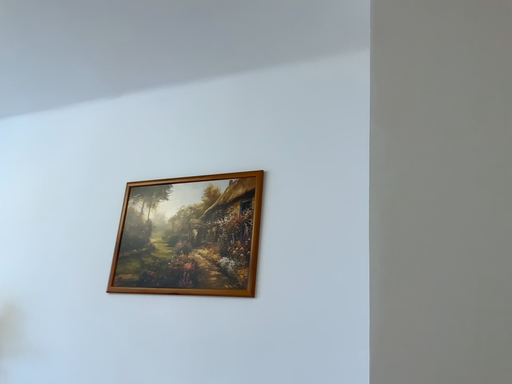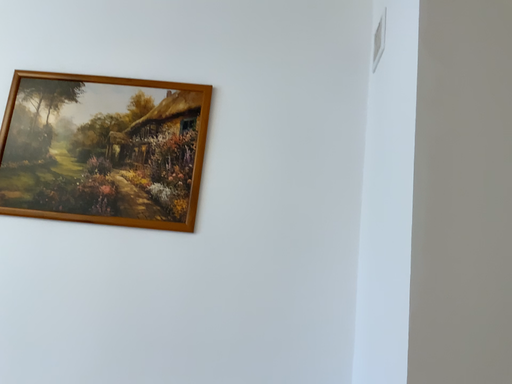
Question: How did the camera likely rotate when shooting the video?

Choices:
 (A) rotated upward
 (B) rotated downward

Answer: (B)